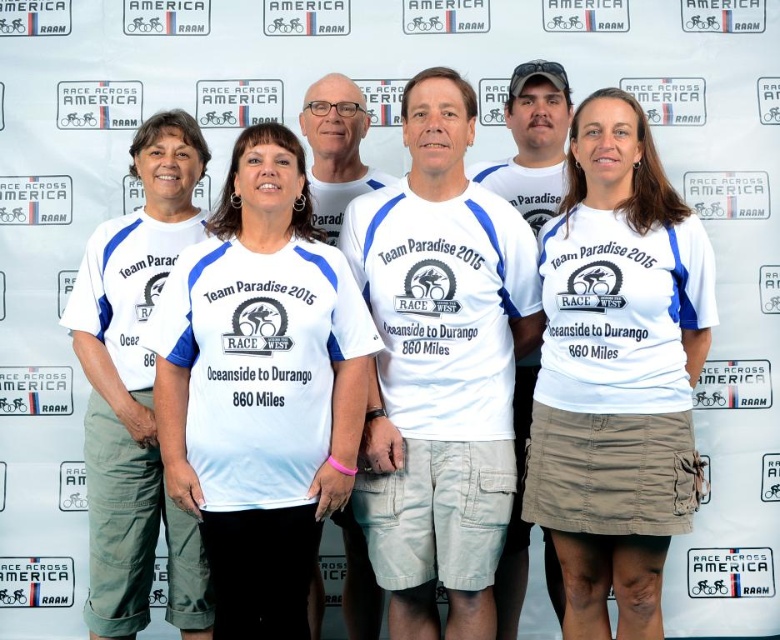
Which of these two, white fabric shirt at center or white cotton shirt at center, stands shorter?

Standing shorter between the two is white fabric shirt at center.

Can you confirm if white fabric shirt at center is positioned above white cotton shirt at center?

Actually, white fabric shirt at center is below white cotton shirt at center.

What do you see at coordinates (261, 387) in the screenshot?
I see `white fabric shirt at center` at bounding box center [261, 387].

The height and width of the screenshot is (640, 780). I want to click on white fabric shirt at center, so [x=261, y=387].

Is white fabric shirt at center further to the viewer compared to white cotton t-shirt at center?

No, white fabric shirt at center is closer to the viewer.

Which of these two, white fabric shirt at center or white cotton t-shirt at center, stands shorter?

Standing shorter between the two is white cotton t-shirt at center.

Between point (156, 342) and point (605, 227), which one is positioned in front?

Point (156, 342) is in front.

Image resolution: width=780 pixels, height=640 pixels. I want to click on white fabric shirt at center, so click(x=261, y=387).

Is white cotton shirt at center positioned at the back of white cotton t-shirt at center?

No, white cotton shirt at center is closer to the viewer.

In order to click on white cotton shirt at center in this screenshot , I will do `click(617, 371)`.

Where is `white cotton shirt at center`? Image resolution: width=780 pixels, height=640 pixels. white cotton shirt at center is located at coordinates 617,371.